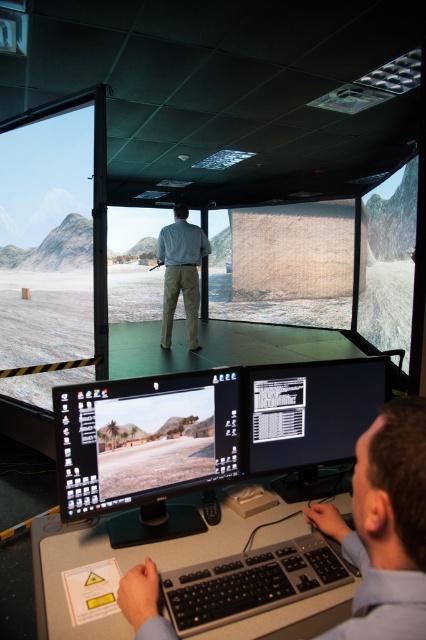
Does point (293, 211) come farther from viewer compared to point (379, 289)?

Yes, point (293, 211) is farther from viewer.

Between matte beige wall at center and matte glass projection screen at right, which one appears on the left side from the viewer's perspective?

Positioned to the left is matte beige wall at center.

Which is in front, point (242, 234) or point (362, 269)?

Point (362, 269) is more forward.

What are the coordinates of `matte beige wall at center` in the screenshot? It's located at (284, 264).

Is black glossy monitor at center wider than matte glass projection screen at right?

Indeed, black glossy monitor at center has a greater width compared to matte glass projection screen at right.

Is point (316, 445) farther from camera compared to point (373, 273)?

No, it is not.

Measure the distance between black glossy monitor at center and camera.

A distance of 1.46 meters exists between black glossy monitor at center and camera.

Where is `black glossy monitor at center`? This screenshot has width=426, height=640. black glossy monitor at center is located at coordinates tap(310, 420).

Does matte beige wall at center lie in front of black glossy monitor at center?

No, it is not.

Is matte beige wall at center to the left of black glossy monitor at center from the viewer's perspective?

Incorrect, matte beige wall at center is not on the left side of black glossy monitor at center.

Where is `matte beige wall at center`? matte beige wall at center is located at coordinates (284, 264).